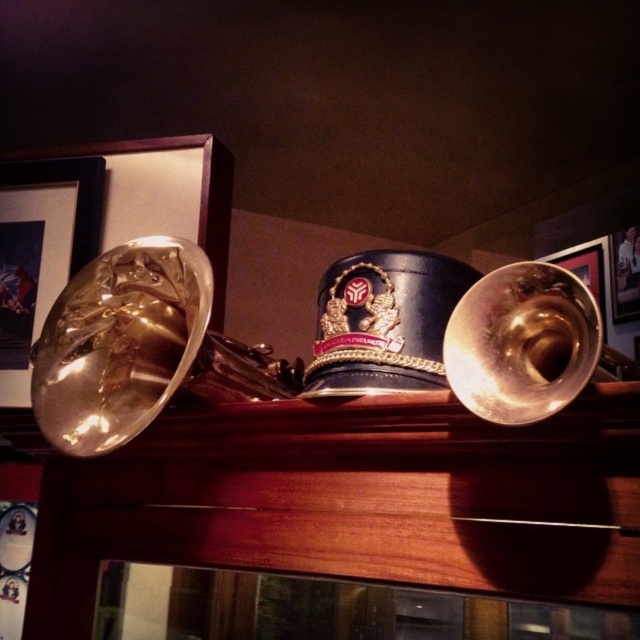
Is gold shiny trumpet at left wider than metallic gold picture frame at upper right?

Yes, gold shiny trumpet at left is wider than metallic gold picture frame at upper right.

Does gold shiny trumpet at left appear over metallic gold picture frame at upper right?

No.

Between point (189, 273) and point (625, 296), which one is positioned in front?

Point (189, 273) is more forward.

I want to click on gold shiny trumpet at left, so click(x=134, y=348).

Between point (81, 179) and point (609, 276), which one is positioned behind?

Positioned behind is point (609, 276).

Is metallic gold bell at left smaller than metallic gold trumpet at right?

No, metallic gold bell at left is not smaller than metallic gold trumpet at right.

Does point (44, 308) lie behind point (570, 259)?

No, (44, 308) is in front of (570, 259).

The image size is (640, 640). Identify the location of metallic gold bell at left. (40, 250).

Can you confirm if metallic gold bell at left is bigger than metallic gold picture frame at upper right?

Yes, metallic gold bell at left is bigger than metallic gold picture frame at upper right.

What do you see at coordinates (40, 250) in the screenshot? Image resolution: width=640 pixels, height=640 pixels. I see `metallic gold bell at left` at bounding box center [40, 250].

The width and height of the screenshot is (640, 640). In order to click on metallic gold bell at left in this screenshot , I will do `click(40, 250)`.